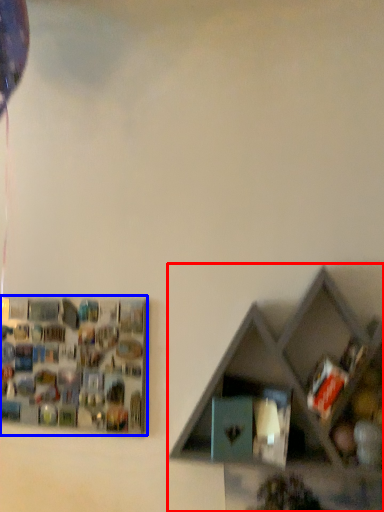
Question: Which of the following is the farthest to the observer, shelf (highlighted by a red box) or shelf (highlighted by a blue box)?

Choices:
 (A) shelf
 (B) shelf

Answer: (B)